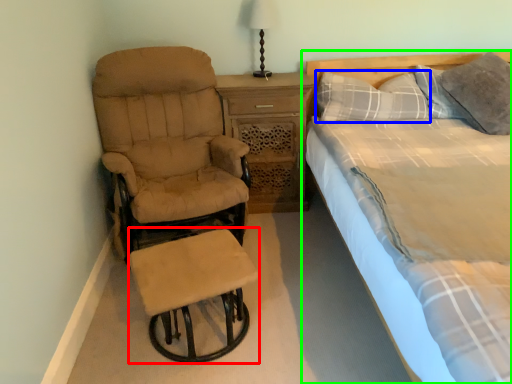
Question: Based on their relative distances, which object is farther from bar stool (highlighted by a red box)? Choose from pillow (highlighted by a blue box) and bed (highlighted by a green box).

Choices:
 (A) pillow
 (B) bed

Answer: (B)